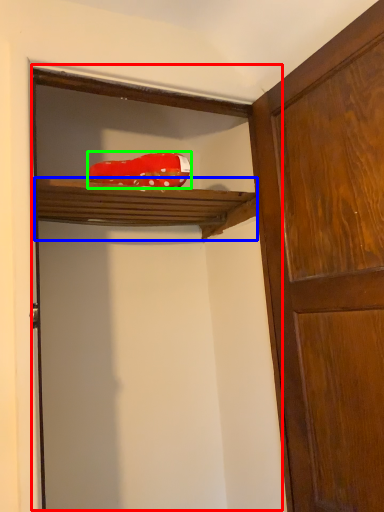
Question: Which object is positioned farthest from door (highlighted by a red box)? Select from shelf (highlighted by a blue box) and material (highlighted by a green box).

Choices:
 (A) shelf
 (B) material

Answer: (B)